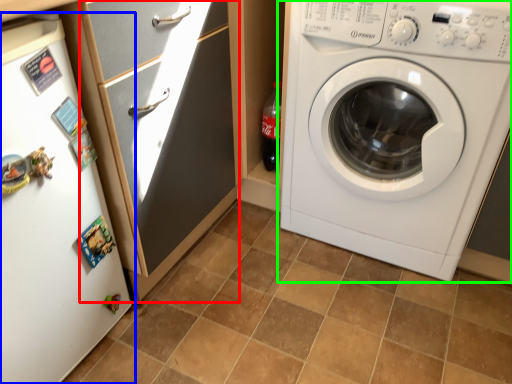
Question: Which object is the farthest from screen door (highlighted by a red box)? Choose among these: fridge (highlighted by a blue box) or washing machine (highlighted by a green box).

Choices:
 (A) fridge
 (B) washing machine

Answer: (B)